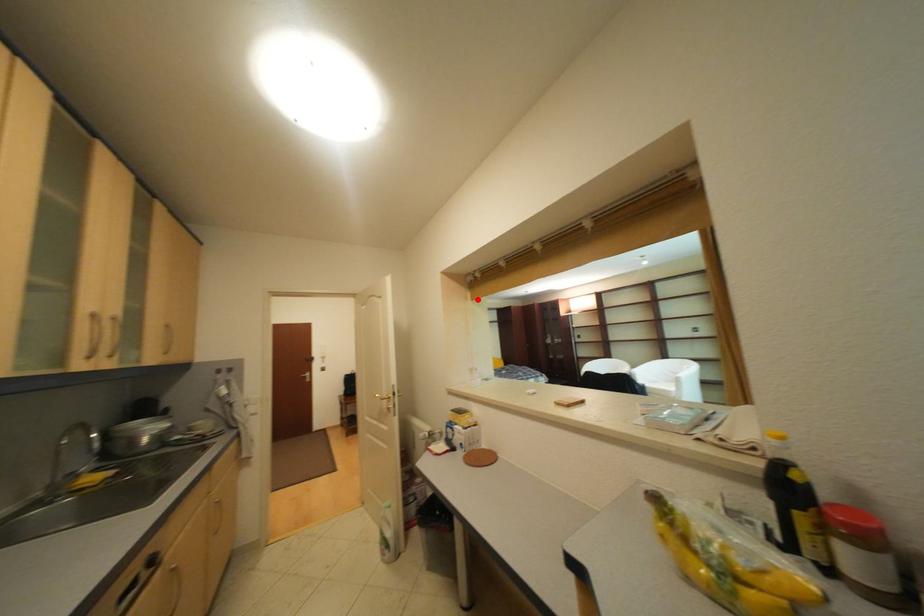
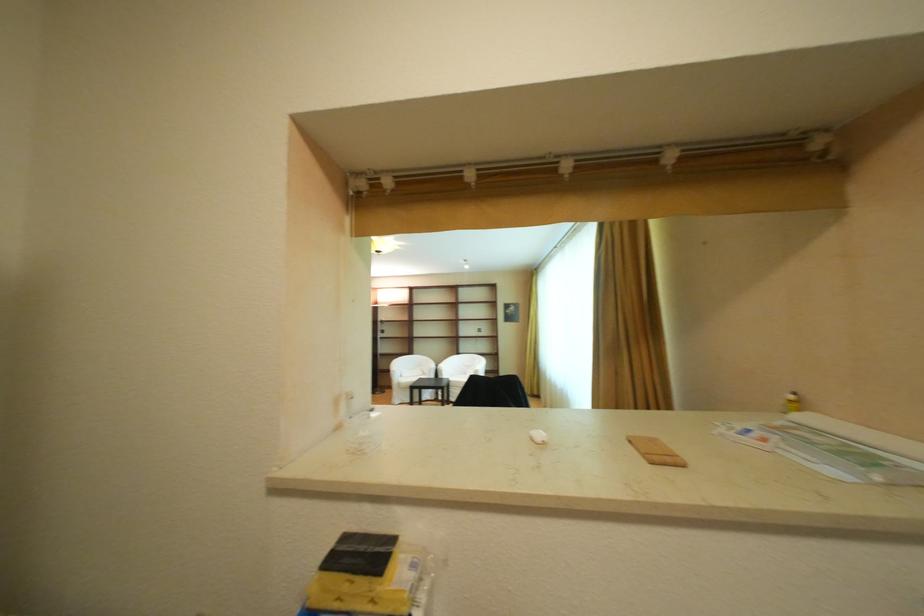
Locate, in the second image, the point that corresponds to the highlighted location in the first image.

(351, 228)